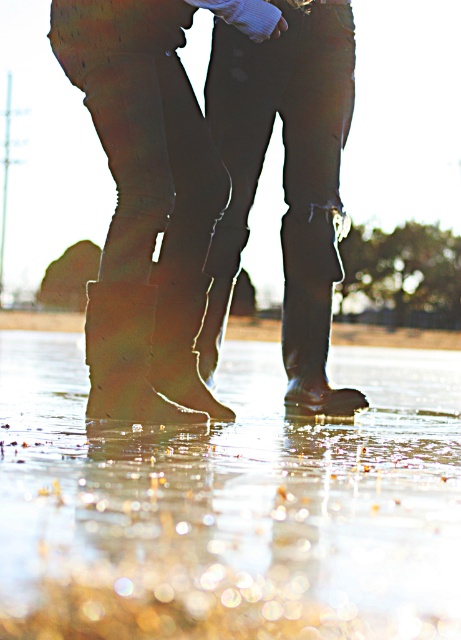
Which of these two, clear water at lower center or leather boots at center, stands shorter?

Standing shorter between the two is clear water at lower center.

The height and width of the screenshot is (640, 461). I want to click on clear water at lower center, so click(231, 504).

Where is `clear water at lower center`? This screenshot has height=640, width=461. clear water at lower center is located at coordinates (231, 504).

Where is `clear water at lower center`? clear water at lower center is located at coordinates (231, 504).